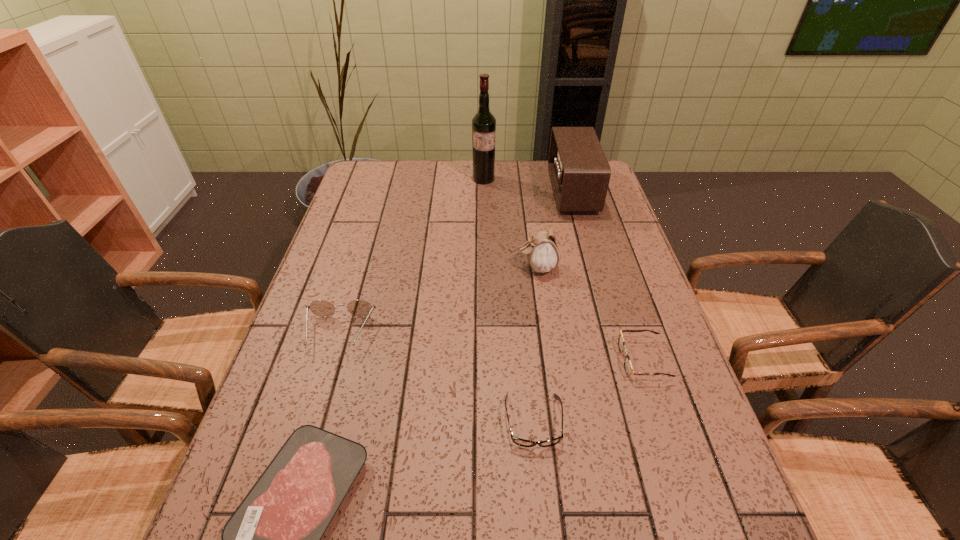
You are a GUI agent. You are given a task and a screenshot of the screen. Output one action in this format:
    pyautogui.click(x=<x>, y=<y>)
    Task: Click on the tallest object
    The width and height of the screenshot is (960, 540).
    Given the screenshot: What is the action you would take?
    pyautogui.click(x=483, y=123)

In order to click on radio receiver in this screenshot , I will do `click(580, 173)`.

This screenshot has height=540, width=960. In order to click on the third farthest object in this screenshot , I will do `click(542, 251)`.

What are the coordinates of `pouch` in the screenshot? It's located at click(542, 251).

The width and height of the screenshot is (960, 540). Identify the location of the fourth shortest object. (322, 308).

Find the location of a particular element. The image size is (960, 540). the leftmost spectacles is located at coordinates (322, 308).

Where is `the rightmost spectacles`? the rightmost spectacles is located at coordinates (628, 367).

I want to click on the nearest spectacles, so click(x=518, y=441).

The image size is (960, 540). I want to click on free location located on the front and back of the wine bottle, so click(485, 253).

You are a GUI agent. You are given a task and a screenshot of the screen. Output one action in this format:
    pyautogui.click(x=<x>, y=<y>)
    Task: Click on the free region located on the front-facing side of the sixth shortest object
    The height and width of the screenshot is (540, 960).
    Given the screenshot: What is the action you would take?
    pyautogui.click(x=446, y=191)